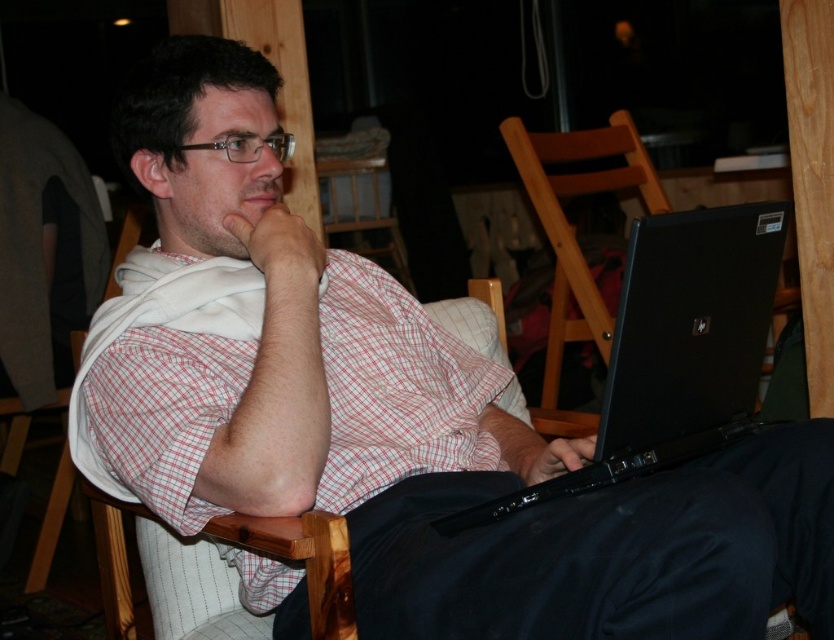
Based on the scene description, can you determine the spatial relationship between the white checkered shirt at center and the wooden chair at center?

The white checkered shirt at center is located below the wooden chair at center.

You are a delivery person who needs to place a small package between the white checkered shirt at center and the wooden chair at center. The package is 1 meter long. Will it fit in the space between them?

The distance between the white checkered shirt at center and the wooden chair at center is 1.27 meters. Since the package is 1 meter long, it will fit comfortably in the space between them.